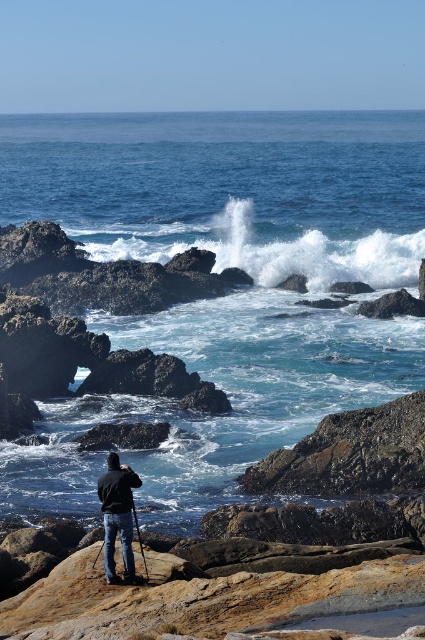
You are a photographer standing on the rocky outcrop. You notice the blue water at center and the black matte jacket at center. Which object is closer to you, the photographer?

The blue water at center is closer to you than the black matte jacket at center, which is positioned behind it.

You are a photographer planning to capture the blue water at center and the white frothy wave at center in a single frame. Which object should you focus on first if you want to ensure both are in the frame without moving the camera?

The blue water at center is larger in size than the white frothy wave at center, so you should focus on the larger blue water at center first to ensure it fits within the frame, then adjust to include the smaller white frothy wave at center.